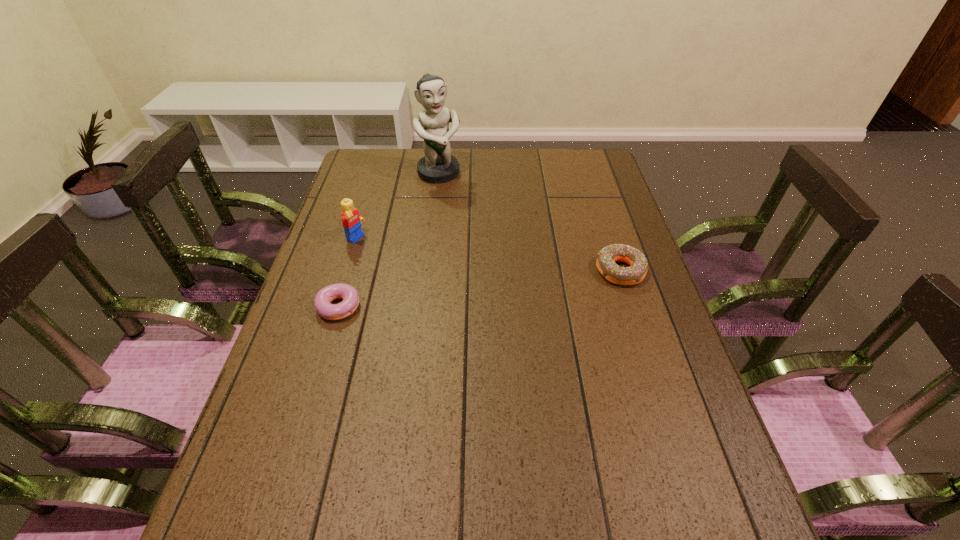
The width and height of the screenshot is (960, 540). Identify the location of free space between the left doughnut and the rightmost object. (480, 288).

Where is `empty space that is in between the taller doughnut and the second object from right to left`? This screenshot has width=960, height=540. empty space that is in between the taller doughnut and the second object from right to left is located at coordinates (x=530, y=222).

What are the coordinates of `vacant area that lies between the second object from right to left and the taller doughnut` in the screenshot? It's located at (530, 222).

In order to click on free space between the second tallest object and the farthest object in this screenshot , I will do `click(397, 206)`.

Image resolution: width=960 pixels, height=540 pixels. What are the coordinates of `free space between the tallest object and the shortest object` in the screenshot? It's located at (389, 239).

Find the location of a particular element. The height and width of the screenshot is (540, 960). free space between the second object from right to left and the third shortest object is located at coordinates (397, 206).

This screenshot has width=960, height=540. I want to click on object that ranks as the second closest to the second tallest object, so click(x=438, y=166).

Locate which object is the closest to the second farthest object. Please provide its 2D coordinates. Your answer should be formatted as a tuple, i.e. [(x, y)], where the tuple contains the x and y coordinates of a point satisfying the conditions above.

[(323, 299)]

The width and height of the screenshot is (960, 540). I want to click on vacant space that satisfies the following two spatial constraints: 1. on the front side of the shorter doughnut; 2. on the right side of the second tallest object, so click(x=336, y=305).

Locate an element on the screen. vacant position in the image that satisfies the following two spatial constraints: 1. on the back side of the shorter doughnut; 2. on the left side of the second object from right to left is located at coordinates (378, 173).